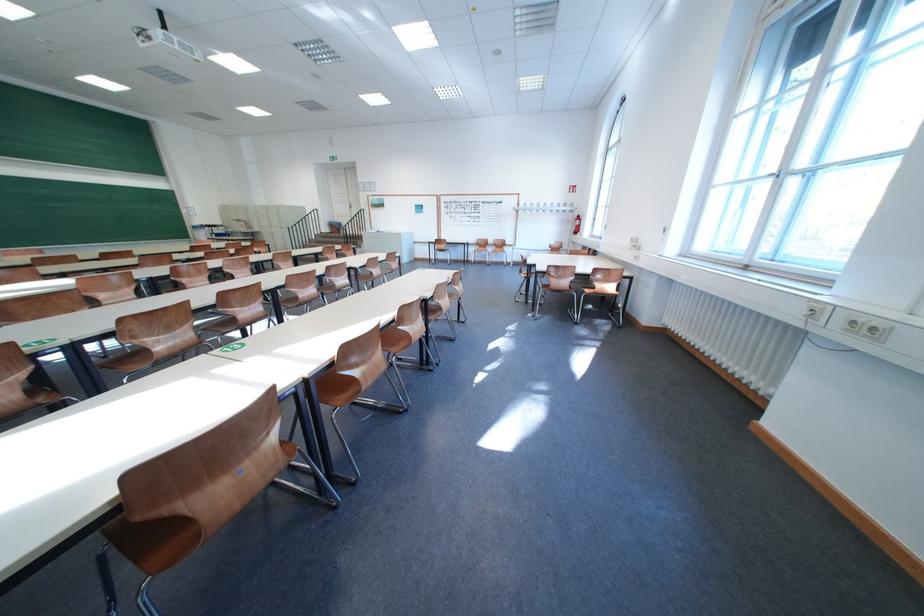
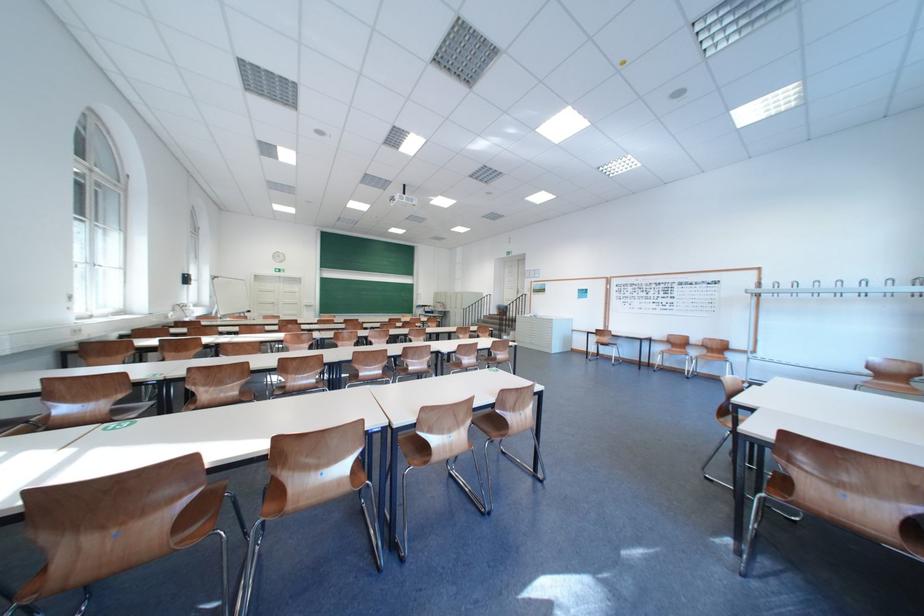
Locate, in the second image, the point that corresponds to (x=342, y=270) in the first image.

(419, 351)